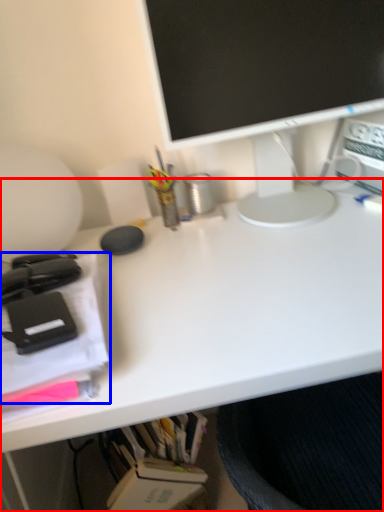
Question: Which of the following is the closest to the observer, desk (highlighted by a red box) or office supplies (highlighted by a blue box)?

Choices:
 (A) desk
 (B) office supplies

Answer: (B)